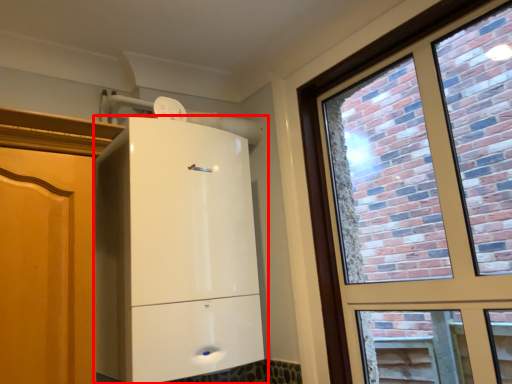
Question: From the image's perspective, what is the correct spatial positioning of cupboard (annotated by the red box) in reference to window?

Choices:
 (A) below
 (B) above

Answer: (A)